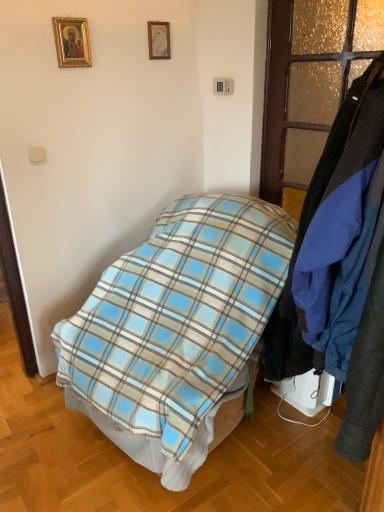
What is the approximate width of blue plaid blanket at center?

It is 1.07 meters.

Locate an element on the screen. gold-framed picture at upper left, which ranks as the 1th picture frame in front-to-back order is located at coordinates (72, 42).

Is blue plaid blanket at center wider or thinner than gold-framed picture at upper left, acting as the first picture frame starting from the left?

Considering their sizes, blue plaid blanket at center looks broader than gold-framed picture at upper left, acting as the first picture frame starting from the left.

Measure the distance between blue plaid blanket at center and gold-framed picture at upper left, which ranks as the 1th picture frame in front-to-back order.

They are 4.07 feet apart.

From the image's perspective, starting from the blue plaid blanket at center, which picture frame is the 1st one above? Please provide its 2D coordinates.

[(72, 42)]

Is blue plaid blanket at center located outside gold-framed picture at upper left, which ranks as the second picture frame in back-to-front order?

Yes.

Could blue plaid blanket at center be considered to be inside gold-framed picture at upper left, which ranks as the second picture frame in back-to-front order?

Actually, blue plaid blanket at center is outside gold-framed picture at upper left, which ranks as the second picture frame in back-to-front order.

From the image's perspective, which one is positioned higher, gold-framed picture at upper left, which ranks as the 1th picture frame in front-to-back order, or blue plaid blanket at center?

gold-framed picture at upper left, which ranks as the 1th picture frame in front-to-back order, is shown above in the image.

Which is less distant, (73, 18) or (146, 467)?

Clearly, point (73, 18) is more distant from the camera than point (146, 467).

Which object is closer to the camera, gold-framed picture at upper left, arranged as the second picture frame when viewed from the right, or blue plaid blanket at center?

blue plaid blanket at center is closer to the camera.

Considering the sizes of objects blue fabric coat at right and gold-framed picture at upper left, acting as the first picture frame starting from the left, in the image provided, who is smaller, blue fabric coat at right or gold-framed picture at upper left, acting as the first picture frame starting from the left,?

gold-framed picture at upper left, acting as the first picture frame starting from the left, is smaller.

Does blue fabric coat at right turn towards gold-framed picture at upper left, arranged as the second picture frame when viewed from the right?

No.

Can you tell me how much blue fabric coat at right and gold-framed picture at upper left, which ranks as the 1th picture frame in front-to-back order, differ in facing direction?

The facing directions of blue fabric coat at right and gold-framed picture at upper left, which ranks as the 1th picture frame in front-to-back order, are 88.5 degrees apart.

Is blue fabric coat at right touching gold-framed picture at upper left, acting as the first picture frame starting from the left?

blue fabric coat at right is not next to gold-framed picture at upper left, acting as the first picture frame starting from the left, and they're not touching.

From the image's perspective, is textured gold glass door at right located above blue plaid blanket at center?

Correct, textured gold glass door at right appears higher than blue plaid blanket at center in the image.

From the picture: From a real-world perspective, who is located higher, textured gold glass door at right or blue plaid blanket at center?

textured gold glass door at right, from a real-world perspective.

Which of these two, textured gold glass door at right or blue plaid blanket at center, is wider?

Wider between the two is blue plaid blanket at center.

Where is `the 2nd picture frame above when counting from the blue plaid blanket at center (from the image's perspective)`? The image size is (384, 512). the 2nd picture frame above when counting from the blue plaid blanket at center (from the image's perspective) is located at coordinates (159, 40).

Can we say matte gold picture frame at upper center, which appears as the first picture frame when viewed from the back, lies outside blue plaid blanket at center?

Absolutely, matte gold picture frame at upper center, which appears as the first picture frame when viewed from the back, is external to blue plaid blanket at center.

From the image's perspective, which is above, matte gold picture frame at upper center, which is the 2th picture frame from left to right, or blue plaid blanket at center?

matte gold picture frame at upper center, which is the 2th picture frame from left to right, is shown above in the image.

Which of these two, matte gold picture frame at upper center, marked as the first picture frame in a right-to-left arrangement, or blue plaid blanket at center, is bigger?

Bigger between the two is blue plaid blanket at center.

Is point (380, 351) in front of point (157, 52)?

Yes.

In the scene shown: Could you tell me if blue fabric coat at right is turned towards matte gold picture frame at upper center, which is the 2th picture frame from left to right?

No, blue fabric coat at right is not oriented towards matte gold picture frame at upper center, which is the 2th picture frame from left to right.

From a real-world perspective, between blue fabric coat at right and matte gold picture frame at upper center, which appears as the first picture frame when viewed from the back, who is vertically lower?

blue fabric coat at right.

Can matte gold picture frame at upper center, which is the 2th picture frame from left to right, be found inside blue fabric coat at right?

That's incorrect, matte gold picture frame at upper center, which is the 2th picture frame from left to right, is not inside blue fabric coat at right.

Is matte gold picture frame at upper center, marked as the first picture frame in a right-to-left arrangement, wider than gold-framed picture at upper left, arranged as the second picture frame when viewed from the right?

Incorrect, the width of matte gold picture frame at upper center, marked as the first picture frame in a right-to-left arrangement, does not surpass that of gold-framed picture at upper left, arranged as the second picture frame when viewed from the right.

Between matte gold picture frame at upper center, which appears as the second picture frame when viewed from the front, and gold-framed picture at upper left, which ranks as the second picture frame in back-to-front order, which one is positioned in front?

gold-framed picture at upper left, which ranks as the second picture frame in back-to-front order.

Would you say matte gold picture frame at upper center, which appears as the second picture frame when viewed from the front, is outside gold-framed picture at upper left, which ranks as the 1th picture frame in front-to-back order?

Yes, matte gold picture frame at upper center, which appears as the second picture frame when viewed from the front, is not within gold-framed picture at upper left, which ranks as the 1th picture frame in front-to-back order.

Where is `picture frame that is the 1st object above the blue plaid blanket at center (from a real-world perspective)`? This screenshot has height=512, width=384. picture frame that is the 1st object above the blue plaid blanket at center (from a real-world perspective) is located at coordinates (72, 42).

Identify the location of bed located underneath the gold-framed picture at upper left, acting as the first picture frame starting from the left (from a real-world perspective). Image resolution: width=384 pixels, height=512 pixels. (176, 329).

Which object lies further to the anchor point matte gold picture frame at upper center, which appears as the second picture frame when viewed from the front, textured gold glass door at right or gold-framed picture at upper left, which ranks as the second picture frame in back-to-front order?

textured gold glass door at right lies further to matte gold picture frame at upper center, which appears as the second picture frame when viewed from the front, than the other object.

Which object lies further to the anchor point gold-framed picture at upper left, which ranks as the 1th picture frame in front-to-back order, matte gold picture frame at upper center, which is the 2th picture frame from left to right, or textured gold glass door at right?

textured gold glass door at right lies further to gold-framed picture at upper left, which ranks as the 1th picture frame in front-to-back order, than the other object.

Estimate the real-world distances between objects in this image. Which object is closer to blue fabric coat at right, matte gold picture frame at upper center, which is the 2th picture frame from left to right, or textured gold glass door at right?

textured gold glass door at right lies closer to blue fabric coat at right than the other object.

Estimate the real-world distances between objects in this image. Which object is closer to blue fabric coat at right, gold-framed picture at upper left, acting as the first picture frame starting from the left, or matte gold picture frame at upper center, which is the 2th picture frame from left to right?

gold-framed picture at upper left, acting as the first picture frame starting from the left.

From the image, which object appears to be farther from blue fabric coat at right, textured gold glass door at right or gold-framed picture at upper left, which ranks as the 1th picture frame in front-to-back order?

gold-framed picture at upper left, which ranks as the 1th picture frame in front-to-back order, is positioned further to the anchor blue fabric coat at right.

Estimate the real-world distances between objects in this image. Which object is further from textured gold glass door at right, blue plaid blanket at center or matte gold picture frame at upper center, which appears as the second picture frame when viewed from the front?

matte gold picture frame at upper center, which appears as the second picture frame when viewed from the front, lies further to textured gold glass door at right than the other object.

Which object lies nearer to the anchor point textured gold glass door at right, blue plaid blanket at center or blue fabric coat at right?

blue plaid blanket at center lies closer to textured gold glass door at right than the other object.

Which object lies nearer to the anchor point blue plaid blanket at center, matte gold picture frame at upper center, which appears as the second picture frame when viewed from the front, or gold-framed picture at upper left, acting as the first picture frame starting from the left?

gold-framed picture at upper left, acting as the first picture frame starting from the left, lies closer to blue plaid blanket at center than the other object.

Identify the location of glass door between matte gold picture frame at upper center, which appears as the second picture frame when viewed from the front, and blue plaid blanket at center, in the vertical direction. Image resolution: width=384 pixels, height=512 pixels. (310, 80).

Where is `picture frame between gold-framed picture at upper left, which ranks as the 1th picture frame in front-to-back order, and blue fabric coat at right from left to right`? The image size is (384, 512). picture frame between gold-framed picture at upper left, which ranks as the 1th picture frame in front-to-back order, and blue fabric coat at right from left to right is located at coordinates (159, 40).

Locate an element on the screen. The width and height of the screenshot is (384, 512). closet between textured gold glass door at right and blue plaid blanket at center in the up-down direction is located at coordinates (341, 269).

You are a GUI agent. You are given a task and a screenshot of the screen. Output one action in this format:
    pyautogui.click(x=<x>, y=<y>)
    Task: Click on the glass door between gold-framed picture at upper left, arranged as the second picture frame when viewed from the right, and blue fabric coat at right from left to right
    
    Given the screenshot: What is the action you would take?
    pyautogui.click(x=310, y=80)